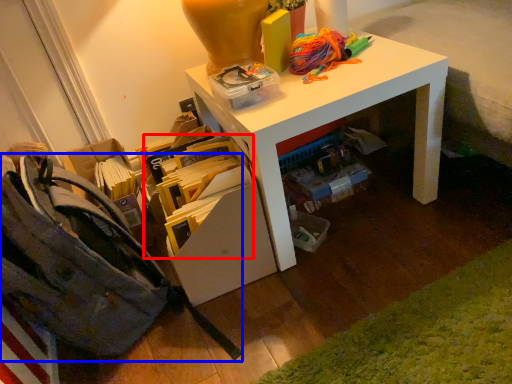
Question: Among these objects, which one is nearest to the camera, book (highlighted by a red box) or shoulder bag (highlighted by a blue box)?

Choices:
 (A) book
 (B) shoulder bag

Answer: (B)